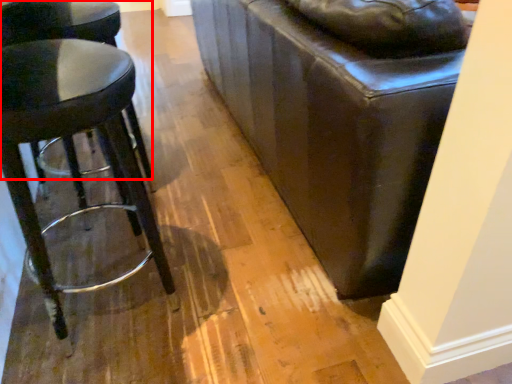
Question: From the image's perspective, what is the correct spatial positioning of stool (annotated by the red box) in reference to stool?

Choices:
 (A) above
 (B) below

Answer: (A)